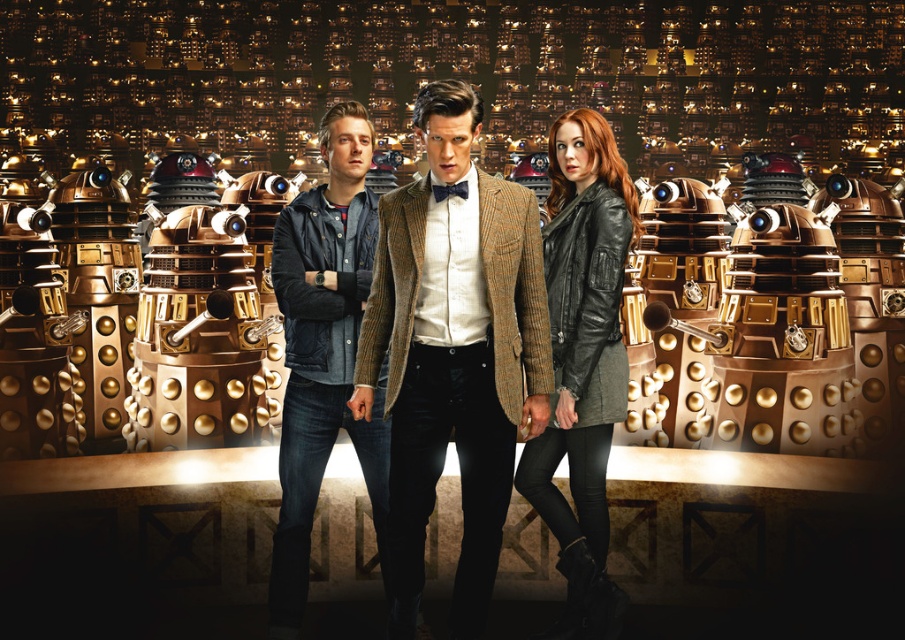
You are organizing a Doctor Who fan event and need to arrange the three people in the scene based on their clothing. The brown corduroy blazer at center and denim jacket at center are two of them. Which clothing item is smaller in size?

The brown corduroy blazer at center is smaller than the denim jacket at center, so the brown corduroy blazer at center is the smaller clothing item.

You are a costume designer analyzing the outfits in the image. Which clothing item is layered on top of the other between the brown corduroy blazer at center and the black leather jacket at center?

The brown corduroy blazer at center is positioned over the black leather jacket at center, so the brown corduroy blazer at center is layered on top.

You are a photographer at a Doctor Who convention and need to adjust the lighting to ensure both the brown corduroy blazer at center and the denim jacket at center are evenly lit. Which of the two clothing items should you lower in the frame to achieve this?

The brown corduroy blazer at center is located below the denim jacket at center, so to adjust the lighting evenly, you should lower the denim jacket at center in the frame.